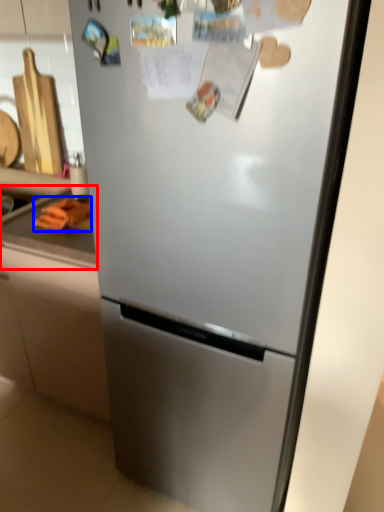
Question: Which object appears farthest to the camera in this image, counter top (highlighted by a red box) or food (highlighted by a blue box)?

Choices:
 (A) counter top
 (B) food

Answer: (A)